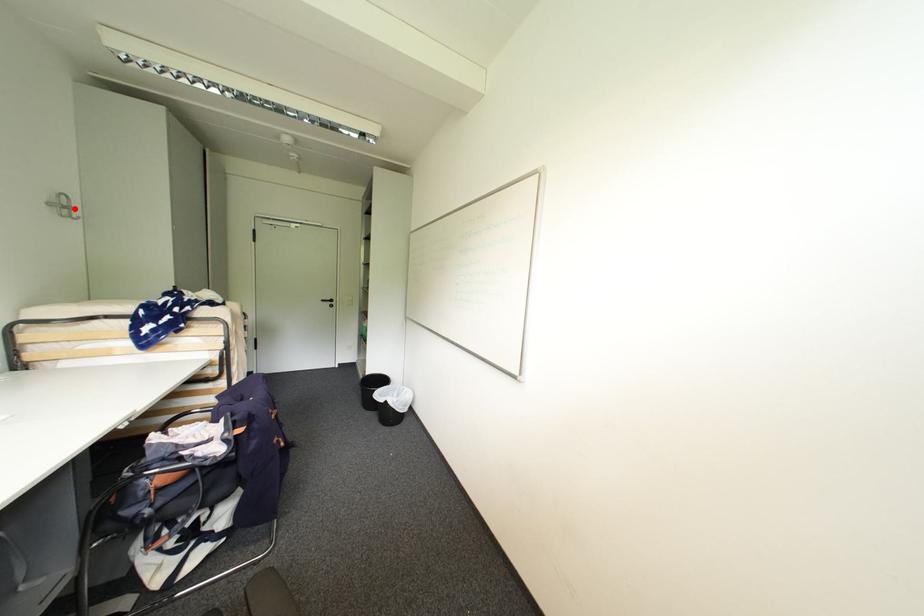
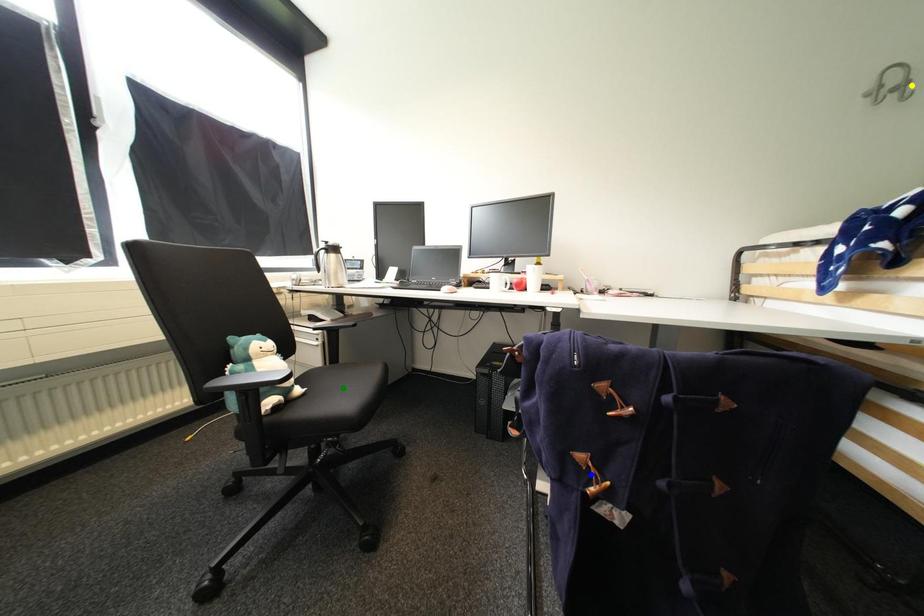
Question: I am providing you with two images of the same scene from different viewpoints. A red point is marked on the first image. You are given multiple points on the second image. Which spot in image 2 lines up with the point in image 1?

Choices:
 (A) green point
 (B) yellow point
 (C) blue point

Answer: (B)